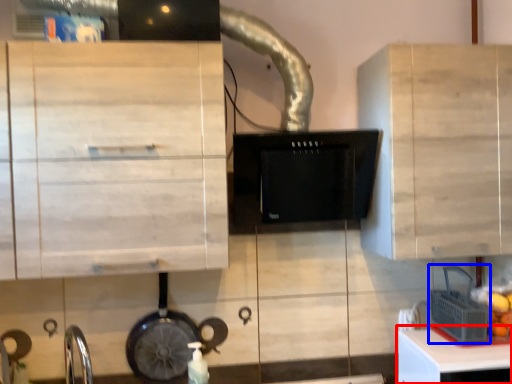
Question: Which of the following is the closest to the observer, table (highlighted by a red box) or appliance (highlighted by a blue box)?

Choices:
 (A) table
 (B) appliance

Answer: (A)